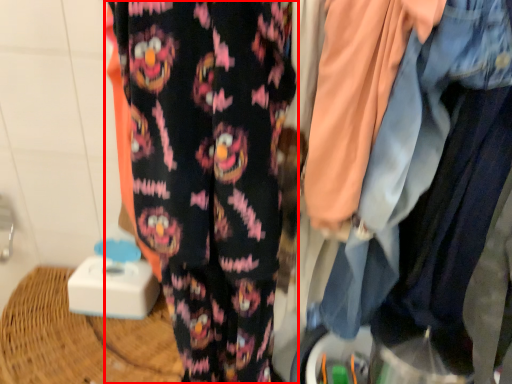
Question: From the image's perspective, considering the relative positions of trousers (annotated by the red box) and denim jacket in the image provided, where is trousers (annotated by the red box) located with respect to the staircase?

Choices:
 (A) below
 (B) above

Answer: (A)